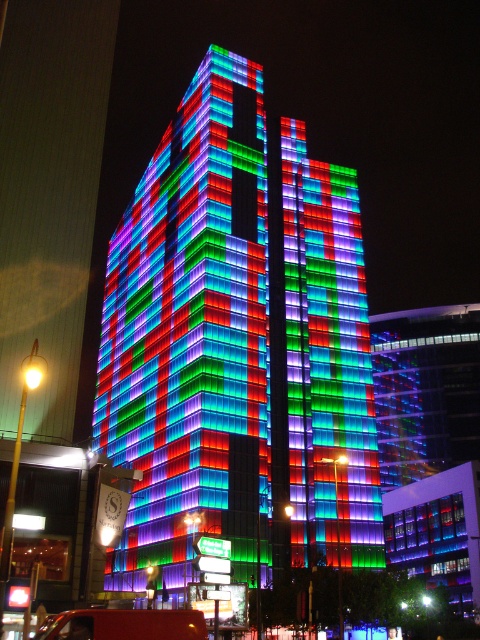
You are standing in front of the illuminated building and want to determine the relative positions of two points marked on the facade. Which point, point (172,253) or point (144,637), is closer to you?

Point (172,253) is further to the viewer than point (144,637), so the point that is closer to you is point (144,637).

You are driving a car and see the metallic red truck at lower left parked on the side of the road. You want to make a U turn to head back. Is the multicolored glass building at center visible in your rearview mirror after the U turn?

The multicolored glass building at center is to the left of the metallic red truck at lower left. After making a U turn, the building would be behind you, so it should be visible in your rearview mirror.